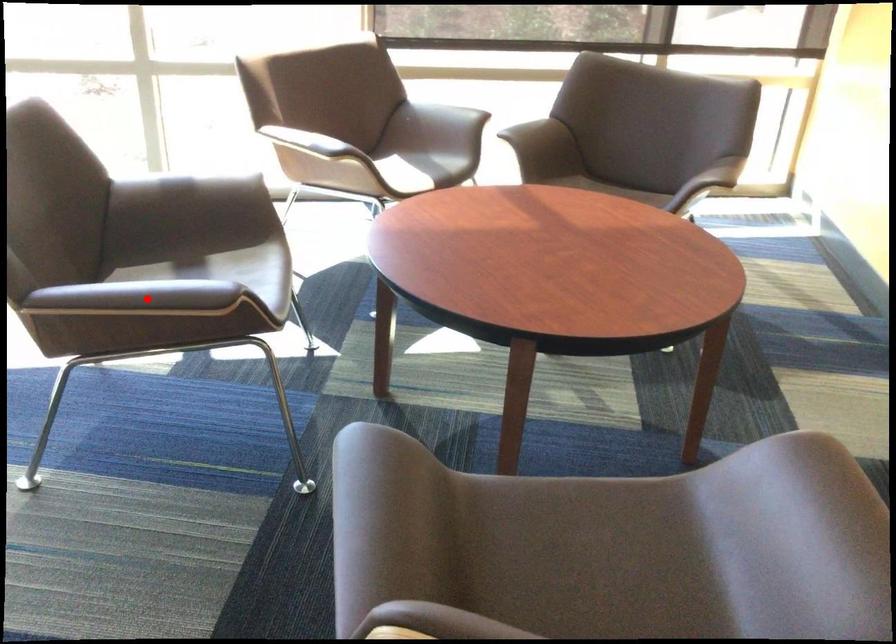
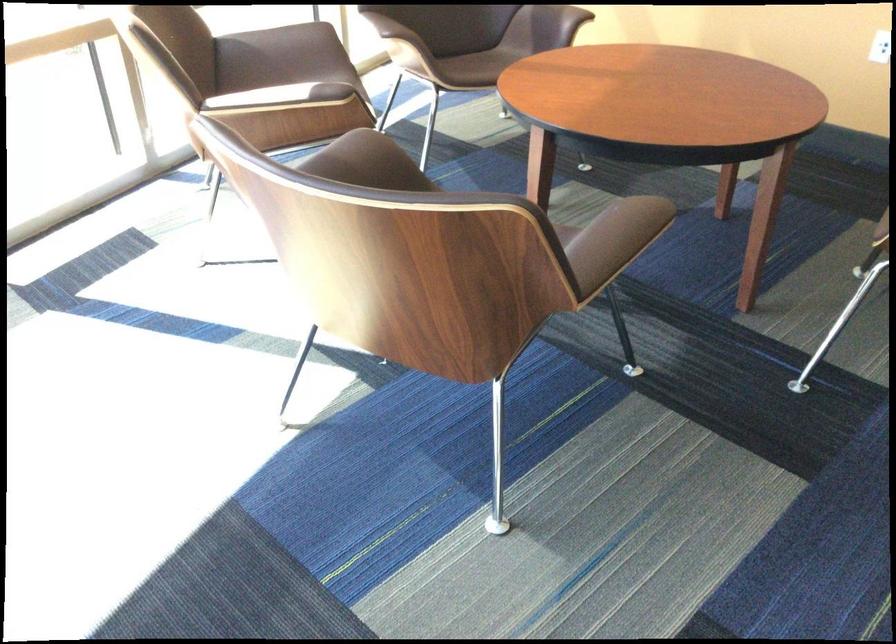
The point at the highlighted location is marked in the first image. Where is the corresponding point in the second image?

(614, 240)